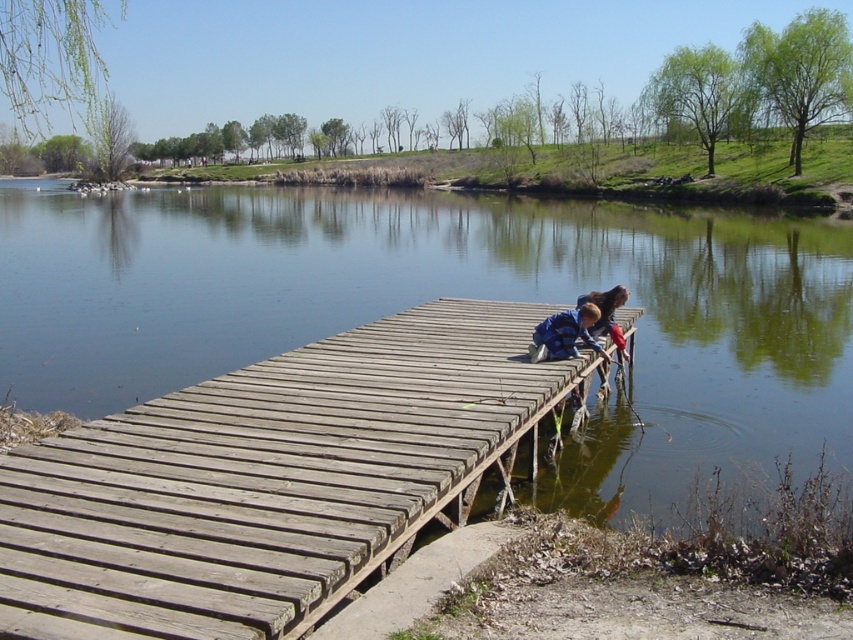
Question: Which object is positioned closest to the smooth water at center?

Choices:
 (A) blue plaid shirt at center
 (B) wooden dock at center

Answer: (A)

Question: Does smooth water at center appear on the right side of wooden dock at center?

Choices:
 (A) yes
 (B) no

Answer: (B)

Question: Based on their relative distances, which object is nearer to the wooden dock at center?

Choices:
 (A) smooth water at center
 (B) blue plaid shirt at center

Answer: (B)

Question: Which of the following is the closest to the observer?

Choices:
 (A) (148, 477)
 (B) (16, 180)

Answer: (A)

Question: Is smooth water at center wider than wooden dock at center?

Choices:
 (A) no
 (B) yes

Answer: (B)

Question: Does wooden dock at center appear under blue plaid shirt at center?

Choices:
 (A) yes
 (B) no

Answer: (A)